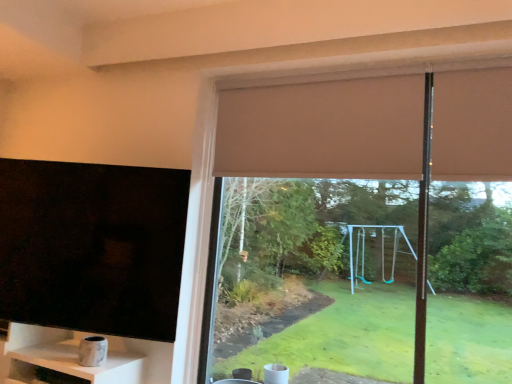
Locate an element on the screen. The width and height of the screenshot is (512, 384). matte brown roller blind at upper center is located at coordinates (215, 147).

Where is `beige fabric curtain at upper center`? beige fabric curtain at upper center is located at coordinates (323, 129).

Is beige fabric curtain at upper center located outside marble-like white shelf at lower left?

beige fabric curtain at upper center lies outside marble-like white shelf at lower left's area.

Does beige fabric curtain at upper center appear on the left side of marble-like white shelf at lower left?

No.

Consider the image. From a real-world perspective, is beige fabric curtain at upper center physically located above or below marble-like white shelf at lower left?

From a real-world perspective, beige fabric curtain at upper center is physically above marble-like white shelf at lower left.

Would you consider beige fabric curtain at upper center to be distant from marble-like white shelf at lower left?

Yes.

Is black matte tv at left further to camera compared to marble-like white shelf at lower left?

Yes, it is.

How different are the orientations of black matte tv at left and marble-like white shelf at lower left in degrees?

The facing directions of black matte tv at left and marble-like white shelf at lower left are 15.6 degrees apart.

Is black matte tv at left located outside marble-like white shelf at lower left?

That's correct, black matte tv at left is outside of marble-like white shelf at lower left.

Which object is wider, black matte tv at left or marble-like white shelf at lower left?

With larger width is marble-like white shelf at lower left.

From the image's perspective, which is below, matte brown roller blind at upper center or black matte tv at left?

matte brown roller blind at upper center appears lower in the image.

Could you tell me if matte brown roller blind at upper center is turned towards black matte tv at left?

No, matte brown roller blind at upper center is not facing towards black matte tv at left.

In the image, is matte brown roller blind at upper center positioned in front of or behind black matte tv at left?

Clearly, matte brown roller blind at upper center is in front of black matte tv at left.

Can you confirm if black matte tv at left is smaller than beige fabric curtain at upper center?

No.

Which object is wider, black matte tv at left or beige fabric curtain at upper center?

Result: black matte tv at left.

Which object is positioned more to the left, black matte tv at left or beige fabric curtain at upper center?

black matte tv at left.

From the image's perspective, is beige fabric curtain at upper center located above or below matte brown roller blind at upper center?

Clearly, from the image's perspective, beige fabric curtain at upper center is above matte brown roller blind at upper center.

Which is more to the left, beige fabric curtain at upper center or matte brown roller blind at upper center?

Positioned to the left is beige fabric curtain at upper center.

Are beige fabric curtain at upper center and matte brown roller blind at upper center making contact?

No, beige fabric curtain at upper center is not next to matte brown roller blind at upper center.

From a real-world perspective, who is located lower, beige fabric curtain at upper center or matte brown roller blind at upper center?

From a 3D spatial view, matte brown roller blind at upper center is below.

Considering the points (63, 373) and (85, 273), which point is behind, point (63, 373) or point (85, 273)?

The point (85, 273) is more distant.

Are marble-like white shelf at lower left and black matte tv at left located far from each other?

No, marble-like white shelf at lower left is not far away from black matte tv at left.

Is marble-like white shelf at lower left wider than black matte tv at left?

Yes.

Does marble-like white shelf at lower left have a greater height compared to black matte tv at left?

No.

Considering the sizes of objects black matte tv at left and matte brown roller blind at upper center in the image provided, who is wider, black matte tv at left or matte brown roller blind at upper center?

Wider between the two is black matte tv at left.

The image size is (512, 384). What are the coordinates of `window in front of the black matte tv at left` in the screenshot? It's located at (215, 147).

From a real-world perspective, is black matte tv at left positioned under matte brown roller blind at upper center based on gravity?

Correct, in the physical world, black matte tv at left is lower than matte brown roller blind at upper center.

Is black matte tv at left not close to matte brown roller blind at upper center?

No, there isn't a large distance between black matte tv at left and matte brown roller blind at upper center.

I want to click on shelf below the beige fabric curtain at upper center (from a real-world perspective), so click(x=64, y=356).

Locate an element on the screen. Image resolution: width=512 pixels, height=384 pixels. shelf that is on the left side of black matte tv at left is located at coordinates (64, 356).

From the image, which object appears to be farther from black matte tv at left, beige fabric curtain at upper center or marble-like white shelf at lower left?

beige fabric curtain at upper center.

From the image, which object appears to be farther from matte brown roller blind at upper center, marble-like white shelf at lower left or beige fabric curtain at upper center?

marble-like white shelf at lower left.

Considering their positions, is beige fabric curtain at upper center positioned further to black matte tv at left than matte brown roller blind at upper center?

beige fabric curtain at upper center is positioned further to the anchor black matte tv at left.

Looking at this image, when comparing their distances from beige fabric curtain at upper center, does marble-like white shelf at lower left or black matte tv at left seem further?

The object further to beige fabric curtain at upper center is marble-like white shelf at lower left.

Considering their positions, is black matte tv at left positioned closer to beige fabric curtain at upper center than marble-like white shelf at lower left?

black matte tv at left lies closer to beige fabric curtain at upper center than the other object.

Which object lies further to the anchor point marble-like white shelf at lower left, beige fabric curtain at upper center or black matte tv at left?

beige fabric curtain at upper center.

Based on their spatial positions, is marble-like white shelf at lower left or beige fabric curtain at upper center further from black matte tv at left?

Among the two, beige fabric curtain at upper center is located further to black matte tv at left.

Which object lies further to the anchor point beige fabric curtain at upper center, marble-like white shelf at lower left or matte brown roller blind at upper center?

marble-like white shelf at lower left.

Identify the location of window screen between marble-like white shelf at lower left and matte brown roller blind at upper center. (92, 246).

At what (x,y) coordinates should I click in order to perform the action: click on curtain situated between black matte tv at left and matte brown roller blind at upper center from left to right. Please return your answer as a coordinate pair (x, y). Looking at the image, I should click on (323, 129).

Where is `window screen between beige fabric curtain at upper center and marble-like white shelf at lower left in the up-down direction`? window screen between beige fabric curtain at upper center and marble-like white shelf at lower left in the up-down direction is located at coordinates (92, 246).

Find the location of a particular element. The height and width of the screenshot is (384, 512). curtain between marble-like white shelf at lower left and matte brown roller blind at upper center from left to right is located at coordinates (323, 129).